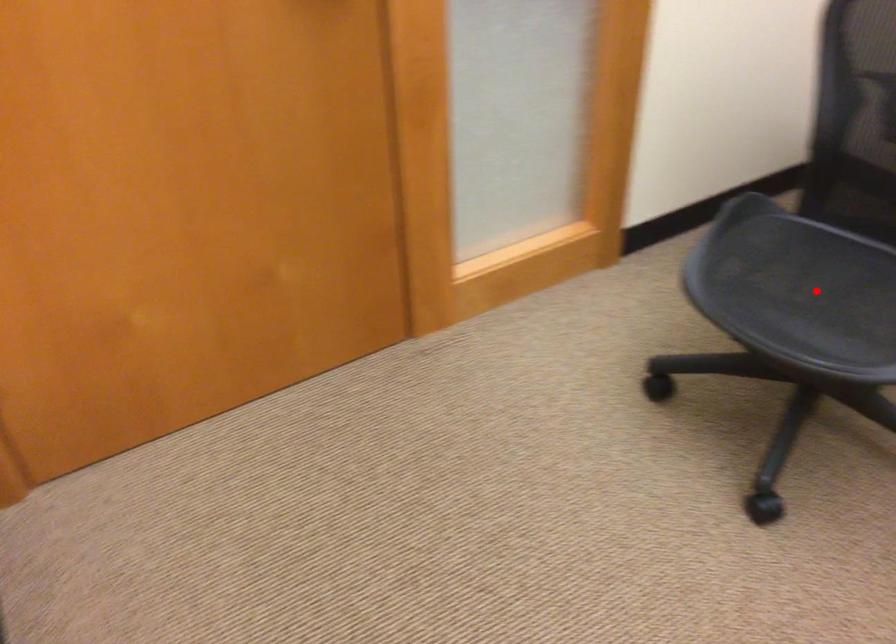
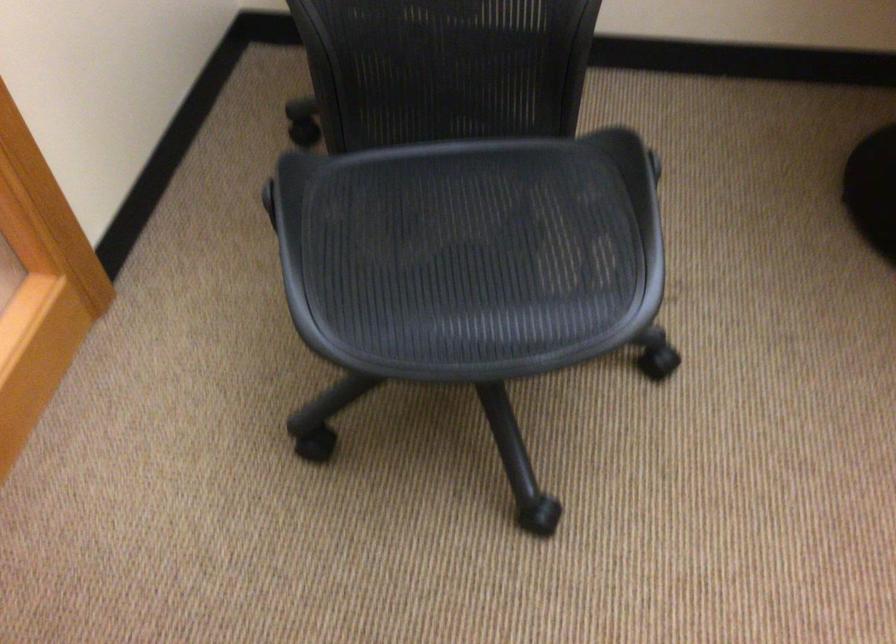
Locate, in the second image, the point that corresponds to the highlighted location in the first image.

(470, 254)